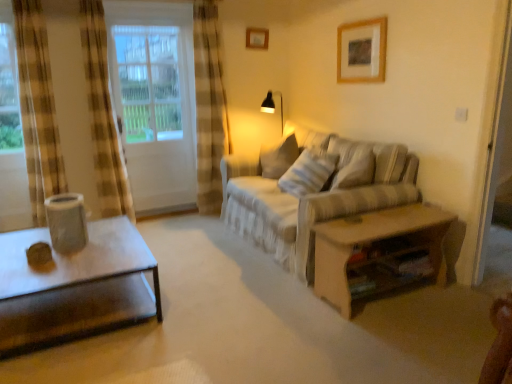
This screenshot has height=384, width=512. What are the coordinates of `empty space that is ontop of wooden table at right (from a real-world perspective)` in the screenshot? It's located at (383, 224).